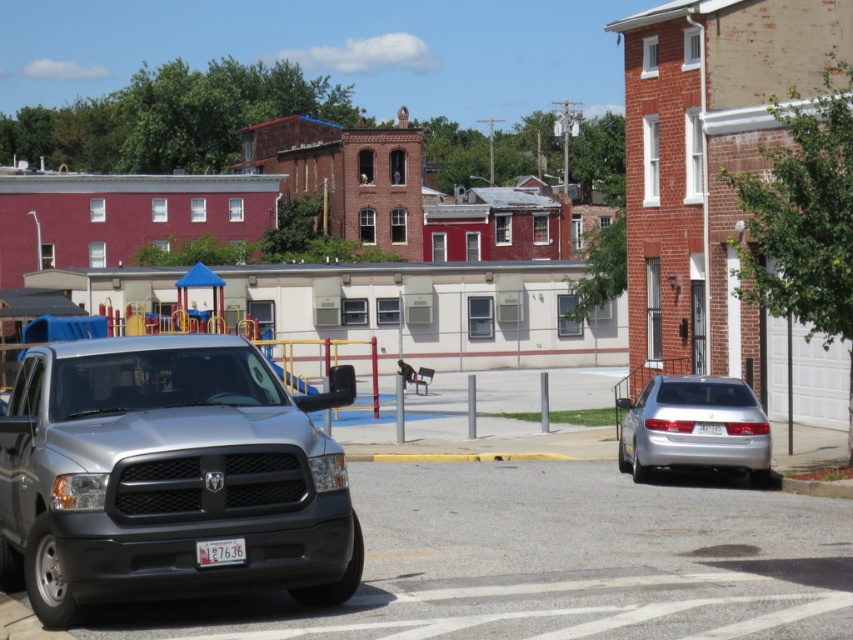
Question: Is matte gray truck at lower left positioned in front of silver metallic sedan at right?

Choices:
 (A) yes
 (B) no

Answer: (A)

Question: Is matte gray truck at lower left wider than silver metallic sedan at right?

Choices:
 (A) no
 (B) yes

Answer: (B)

Question: Is matte gray truck at lower left behind silver metallic sedan at right?

Choices:
 (A) yes
 (B) no

Answer: (B)